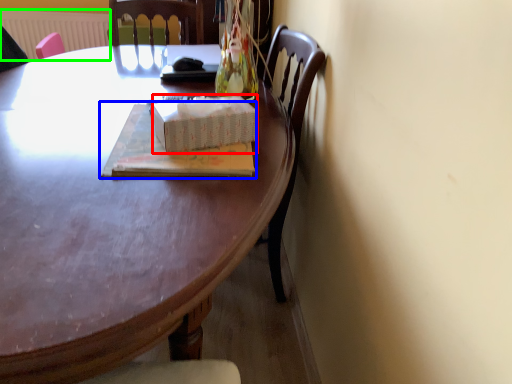
Question: Which object is positioned farthest from box (highlighted by a red box)? Select from book (highlighted by a blue box) and radiator (highlighted by a green box).

Choices:
 (A) book
 (B) radiator

Answer: (B)